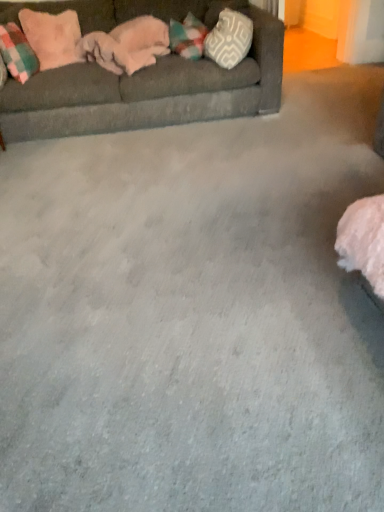
Image resolution: width=384 pixels, height=512 pixels. What do you see at coordinates (229, 39) in the screenshot? I see `white textured pillow at upper right, placed as the third pillow when sorted from left to right` at bounding box center [229, 39].

Measure the distance between point (7, 35) and camera.

Point (7, 35) is 2.93 meters away from camera.

The image size is (384, 512). Describe the element at coordinates (17, 53) in the screenshot. I see `plaid fabric pillow at left, the third pillow from the right` at that location.

Where is `white textured pillow at upper right, which is the first pillow in right-to-left order`? The width and height of the screenshot is (384, 512). white textured pillow at upper right, which is the first pillow in right-to-left order is located at coordinates (229, 39).

Is plaid fabric pillow at left, which appears as the first pillow when viewed from the left, looking in the opposite direction of white textured pillow at upper right, which is the first pillow in right-to-left order?

No, white textured pillow at upper right, which is the first pillow in right-to-left order, is not at the back of plaid fabric pillow at left, which appears as the first pillow when viewed from the left.

In terms of size, does plaid fabric pillow at left, the third pillow from the right, appear bigger or smaller than white textured pillow at upper right, placed as the third pillow when sorted from left to right?

Considering their sizes, plaid fabric pillow at left, the third pillow from the right, takes up less space than white textured pillow at upper right, placed as the third pillow when sorted from left to right.

Between plaid fabric pillow at left, which appears as the first pillow when viewed from the left, and white textured pillow at upper right, placed as the third pillow when sorted from left to right, which one has more height?

Standing taller between the two is white textured pillow at upper right, placed as the third pillow when sorted from left to right.

Which of these two, pink plush pillow at upper left, the 2th pillow when ordered from right to left, or dark gray fabric couch at upper left, is thinner?

Thinner between the two is pink plush pillow at upper left, the 2th pillow when ordered from right to left.

From the picture: Can you see pink plush pillow at upper left, the 2th pillow when ordered from right to left, touching dark gray fabric couch at upper left?

No.

Is pink plush pillow at upper left, which ranks as the 2th pillow in left-to-right order, in front of or behind dark gray fabric couch at upper left in the image?

pink plush pillow at upper left, which ranks as the 2th pillow in left-to-right order, is behind dark gray fabric couch at upper left.

Which of these two, pink plush pillow at upper left, the 2th pillow when ordered from right to left, or dark gray fabric couch at upper left, stands shorter?

Standing shorter between the two is pink plush pillow at upper left, the 2th pillow when ordered from right to left.

Which is more to the left, dark gray fabric couch at upper left or white textured pillow at upper right, which is the first pillow in right-to-left order?

dark gray fabric couch at upper left.

Can you tell me how much dark gray fabric couch at upper left and white textured pillow at upper right, which is the first pillow in right-to-left order, differ in facing direction?

The angular difference between dark gray fabric couch at upper left and white textured pillow at upper right, which is the first pillow in right-to-left order, is 1.11 degrees.

Is dark gray fabric couch at upper left positioned far away from white textured pillow at upper right, which is the first pillow in right-to-left order?

dark gray fabric couch at upper left is near white textured pillow at upper right, which is the first pillow in right-to-left order, not far away.

This screenshot has width=384, height=512. What are the coordinates of `studio couch below the white textured pillow at upper right, placed as the third pillow when sorted from left to right (from the image's perspective)` in the screenshot? It's located at (147, 91).

Can you tell me how much dark gray fabric couch at upper left and pink plush pillow at upper left, which ranks as the 2th pillow in left-to-right order, differ in facing direction?

dark gray fabric couch at upper left and pink plush pillow at upper left, which ranks as the 2th pillow in left-to-right order, are facing 24 degrees away from each other.

Between dark gray fabric couch at upper left and pink plush pillow at upper left, the 2th pillow when ordered from right to left, which one has larger size?

dark gray fabric couch at upper left.

Considering the relative sizes of dark gray fabric couch at upper left and pink plush pillow at upper left, which ranks as the 2th pillow in left-to-right order, in the image provided, is dark gray fabric couch at upper left taller than pink plush pillow at upper left, which ranks as the 2th pillow in left-to-right order,?

Yes.

Is dark gray fabric couch at upper left further to camera compared to pink plush pillow at upper left, which ranks as the 2th pillow in left-to-right order?

No.

Do you think plaid fabric pillow at left, which appears as the first pillow when viewed from the left, is within pink plush pillow at upper left, the 2th pillow when ordered from right to left, or outside of it?

plaid fabric pillow at left, which appears as the first pillow when viewed from the left, is not inside pink plush pillow at upper left, the 2th pillow when ordered from right to left, it's outside.

Which of these two, plaid fabric pillow at left, the third pillow from the right, or pink plush pillow at upper left, which ranks as the 2th pillow in left-to-right order, is wider?

plaid fabric pillow at left, the third pillow from the right.

How much distance is there between plaid fabric pillow at left, the third pillow from the right, and pink plush pillow at upper left, which ranks as the 2th pillow in left-to-right order?

The distance of plaid fabric pillow at left, the third pillow from the right, from pink plush pillow at upper left, which ranks as the 2th pillow in left-to-right order, is 6.67 inches.

How different are the orientations of plaid fabric pillow at left, which appears as the first pillow when viewed from the left, and pink plush pillow at upper left, which ranks as the 2th pillow in left-to-right order, in degrees?

19.6 degrees separate the facing orientations of plaid fabric pillow at left, which appears as the first pillow when viewed from the left, and pink plush pillow at upper left, which ranks as the 2th pillow in left-to-right order.

Is there a large distance between white textured pillow at upper right, placed as the third pillow when sorted from left to right, and dark gray fabric couch at upper left?

No, white textured pillow at upper right, placed as the third pillow when sorted from left to right, is not far from dark gray fabric couch at upper left.

Which object is positioned more to the left, white textured pillow at upper right, which is the first pillow in right-to-left order, or dark gray fabric couch at upper left?

dark gray fabric couch at upper left is more to the left.

Does white textured pillow at upper right, which is the first pillow in right-to-left order, have a lesser height compared to dark gray fabric couch at upper left?

Correct, white textured pillow at upper right, which is the first pillow in right-to-left order, is not as tall as dark gray fabric couch at upper left.

Is white textured pillow at upper right, which is the first pillow in right-to-left order, looking in the opposite direction of plaid fabric pillow at left, which appears as the first pillow when viewed from the left?

No, white textured pillow at upper right, which is the first pillow in right-to-left order, is not facing the opposite direction of plaid fabric pillow at left, which appears as the first pillow when viewed from the left.

Would you consider white textured pillow at upper right, which is the first pillow in right-to-left order, to be distant from plaid fabric pillow at left, the third pillow from the right?

white textured pillow at upper right, which is the first pillow in right-to-left order, is far away from plaid fabric pillow at left, the third pillow from the right.

Based on their positions, is white textured pillow at upper right, which is the first pillow in right-to-left order, located to the left or right of plaid fabric pillow at left, the third pillow from the right?

Based on their positions, white textured pillow at upper right, which is the first pillow in right-to-left order, is located to the right of plaid fabric pillow at left, the third pillow from the right.

How different are the orientations of white textured pillow at upper right, which is the first pillow in right-to-left order, and plaid fabric pillow at left, which appears as the first pillow when viewed from the left, in degrees?

There is a 5.53-degree angle between the facing directions of white textured pillow at upper right, which is the first pillow in right-to-left order, and plaid fabric pillow at left, which appears as the first pillow when viewed from the left.

Where is `pillow below the white textured pillow at upper right, which is the first pillow in right-to-left order (from the image's perspective)`? Image resolution: width=384 pixels, height=512 pixels. pillow below the white textured pillow at upper right, which is the first pillow in right-to-left order (from the image's perspective) is located at coordinates (17, 53).

Identify the location of studio couch in front of the pink plush pillow at upper left, which ranks as the 2th pillow in left-to-right order. Image resolution: width=384 pixels, height=512 pixels. (147, 91).

Looking at the image, which one is located closer to pink plush pillow at upper left, which ranks as the 2th pillow in left-to-right order, dark gray fabric couch at upper left or white textured pillow at upper right, placed as the third pillow when sorted from left to right?

Among the two, dark gray fabric couch at upper left is located nearer to pink plush pillow at upper left, which ranks as the 2th pillow in left-to-right order.

Based on their spatial positions, is dark gray fabric couch at upper left or pink plush pillow at upper left, the 2th pillow when ordered from right to left, further from white textured pillow at upper right, which is the first pillow in right-to-left order?

pink plush pillow at upper left, the 2th pillow when ordered from right to left, is positioned further to the anchor white textured pillow at upper right, which is the first pillow in right-to-left order.

When comparing their distances from white textured pillow at upper right, which is the first pillow in right-to-left order, does pink plush pillow at upper left, which ranks as the 2th pillow in left-to-right order, or plaid fabric pillow at left, which appears as the first pillow when viewed from the left, seem further?

plaid fabric pillow at left, which appears as the first pillow when viewed from the left.

Based on their spatial positions, is plaid fabric pillow at left, which appears as the first pillow when viewed from the left, or white textured pillow at upper right, placed as the third pillow when sorted from left to right, closer to dark gray fabric couch at upper left?

The object closer to dark gray fabric couch at upper left is white textured pillow at upper right, placed as the third pillow when sorted from left to right.

In the scene shown: From the image, which object appears to be farther from plaid fabric pillow at left, which appears as the first pillow when viewed from the left, dark gray fabric couch at upper left or white textured pillow at upper right, which is the first pillow in right-to-left order?

The object further to plaid fabric pillow at left, which appears as the first pillow when viewed from the left, is white textured pillow at upper right, which is the first pillow in right-to-left order.

Estimate the real-world distances between objects in this image. Which object is further from plaid fabric pillow at left, the third pillow from the right, white textured pillow at upper right, placed as the third pillow when sorted from left to right, or pink plush pillow at upper left, which ranks as the 2th pillow in left-to-right order?

Based on the image, white textured pillow at upper right, placed as the third pillow when sorted from left to right, appears to be further to plaid fabric pillow at left, the third pillow from the right.

Which object lies nearer to the anchor point white textured pillow at upper right, which is the first pillow in right-to-left order, plaid fabric pillow at left, the third pillow from the right, or dark gray fabric couch at upper left?

dark gray fabric couch at upper left lies closer to white textured pillow at upper right, which is the first pillow in right-to-left order, than the other object.

From the image, which object appears to be nearer to white textured pillow at upper right, which is the first pillow in right-to-left order, pink plush pillow at upper left, the 2th pillow when ordered from right to left, or dark gray fabric couch at upper left?

dark gray fabric couch at upper left lies closer to white textured pillow at upper right, which is the first pillow in right-to-left order, than the other object.

At what (x,y) coordinates should I click in order to perform the action: click on studio couch between pink plush pillow at upper left, which ranks as the 2th pillow in left-to-right order, and white textured pillow at upper right, placed as the third pillow when sorted from left to right, in the horizontal direction. Please return your answer as a coordinate pair (x, y). Looking at the image, I should click on (147, 91).

Locate an element on the screen. pillow located between plaid fabric pillow at left, which appears as the first pillow when viewed from the left, and dark gray fabric couch at upper left in the left-right direction is located at coordinates (53, 37).

At what (x,y) coordinates should I click in order to perform the action: click on pillow between plaid fabric pillow at left, the third pillow from the right, and white textured pillow at upper right, which is the first pillow in right-to-left order, from left to right. Please return your answer as a coordinate pair (x, y). Looking at the image, I should click on (53, 37).

Where is `studio couch between plaid fabric pillow at left, the third pillow from the right, and white textured pillow at upper right, which is the first pillow in right-to-left order`? This screenshot has height=512, width=384. studio couch between plaid fabric pillow at left, the third pillow from the right, and white textured pillow at upper right, which is the first pillow in right-to-left order is located at coordinates (147, 91).